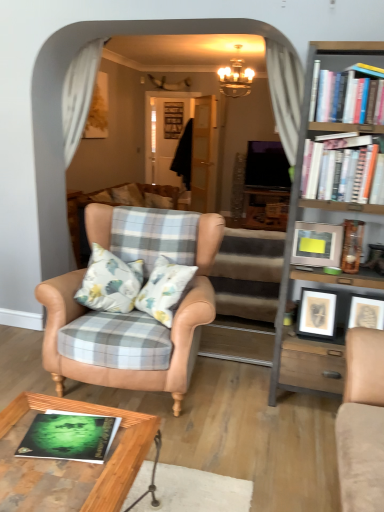
Image resolution: width=384 pixels, height=512 pixels. Find the location of `vacant area that is in front of green matte book at lower left, the first book positioned from the front`. vacant area that is in front of green matte book at lower left, the first book positioned from the front is located at coordinates (56, 486).